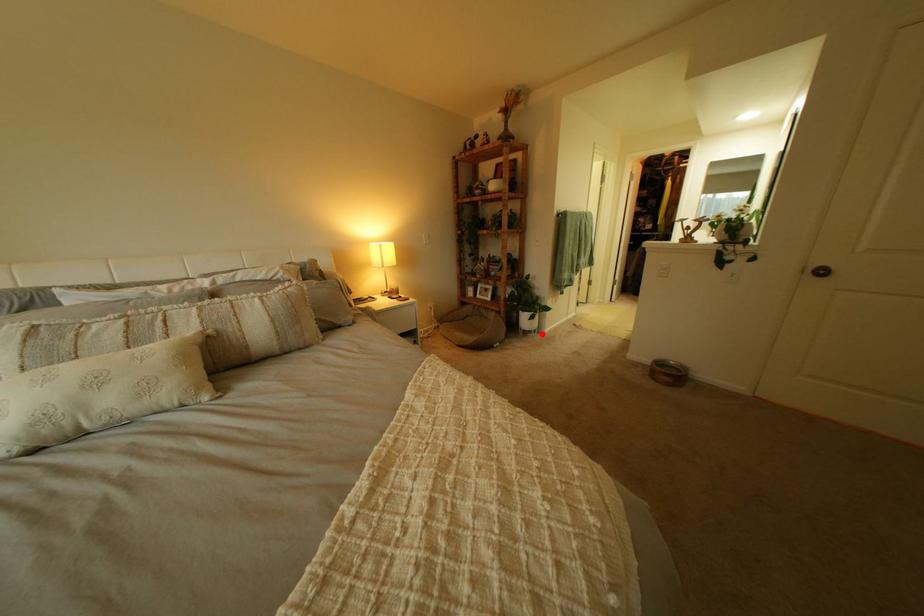
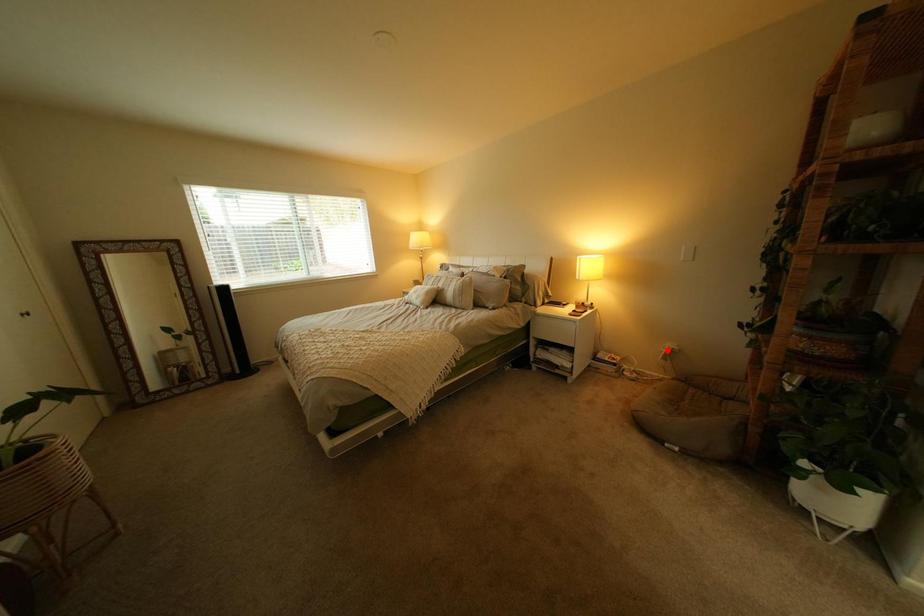
Consider the image. I am providing you with two images of the same scene from different viewpoints. A red point is marked on the first image and another point is marked on the second image. Are the points marked in image1 and image2 representing the same 3D position?

No